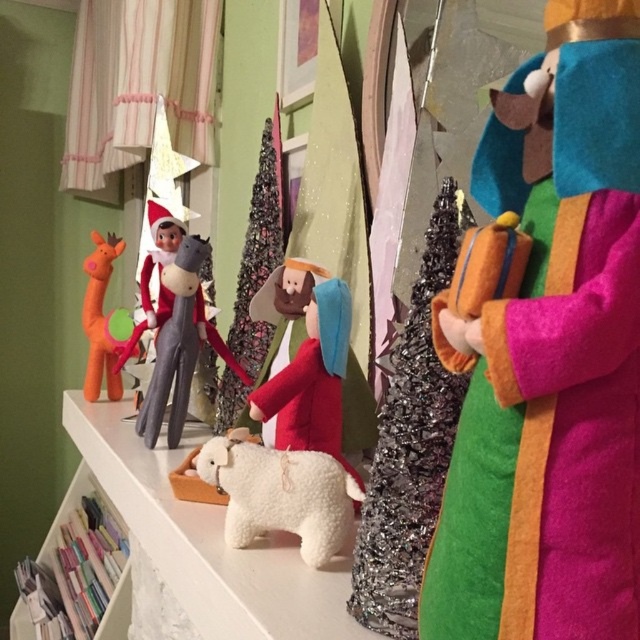
You are setting up a new decoration on the white shelf. You have a small star ornament that needs to be placed at coordinate point 0.9, 0.1. Is there enough space there since the pastel paper at lower left is already occupying that area?

The pastel paper at lower left is located at point [76,572], which is very close to the desired coordinate [64,576]. There may not be enough space to place the star ornament there without overlapping.

You are setting up a Christmas display and want to ensure the orange felt giraffe at left is visible from the front. Is the pastel paper at lower left blocking its view?

The orange felt giraffe at left is behind the pastel paper at lower left, so the pastel paper at lower left is blocking its view from the front.